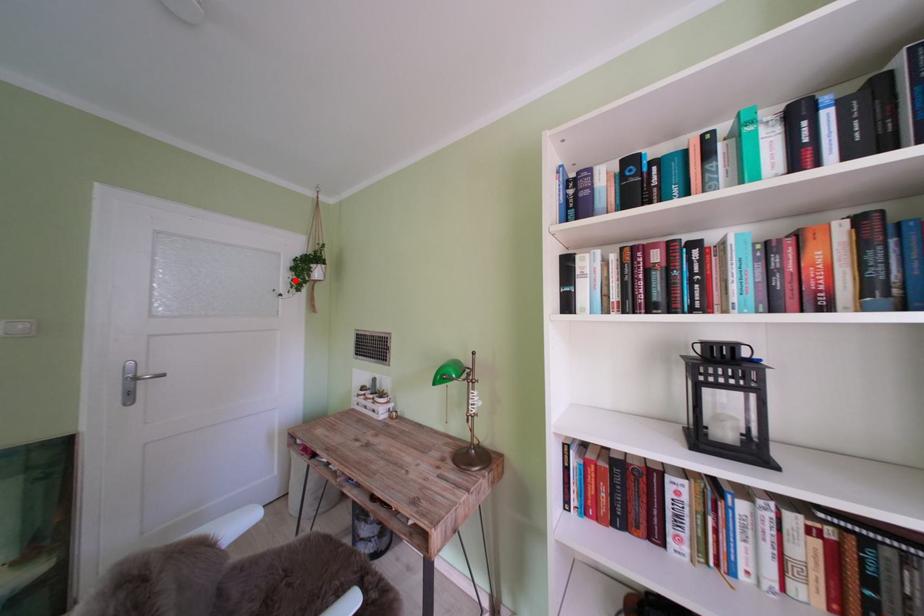
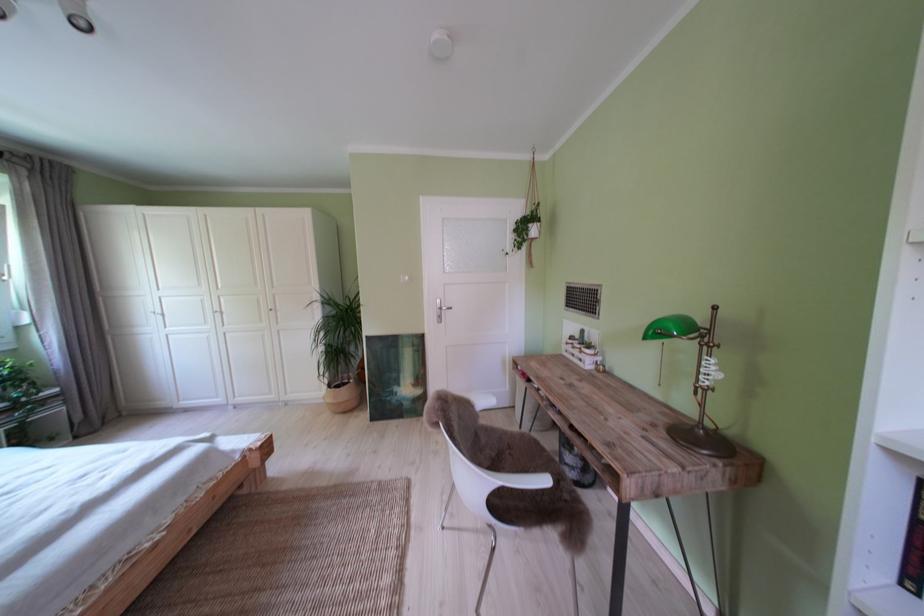
Find the pixel in the second image that matches the highlighted location in the first image.

(520, 244)